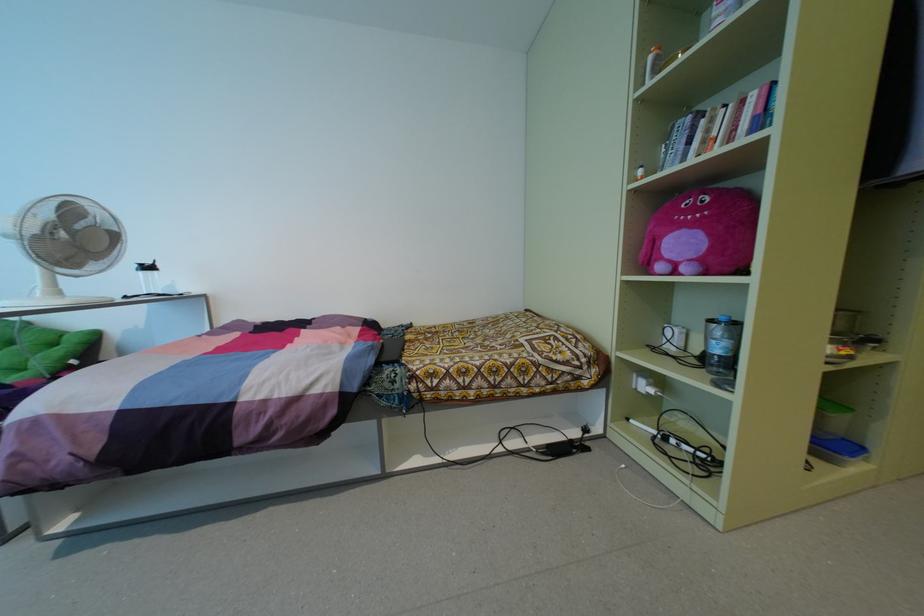
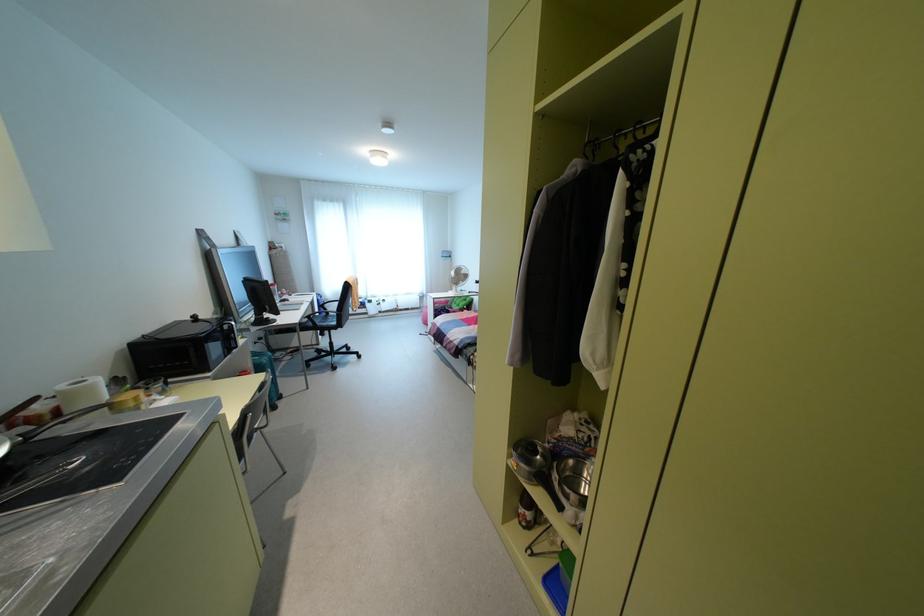
Question: I am providing you with two images of the same scene from different viewpoints. Which of the following objects are not visible in image2?

Choices:
 (A) orange bottle
 (B) wardrobe door handle
 (C) small metal pot
 (D) game controller

Answer: (A)